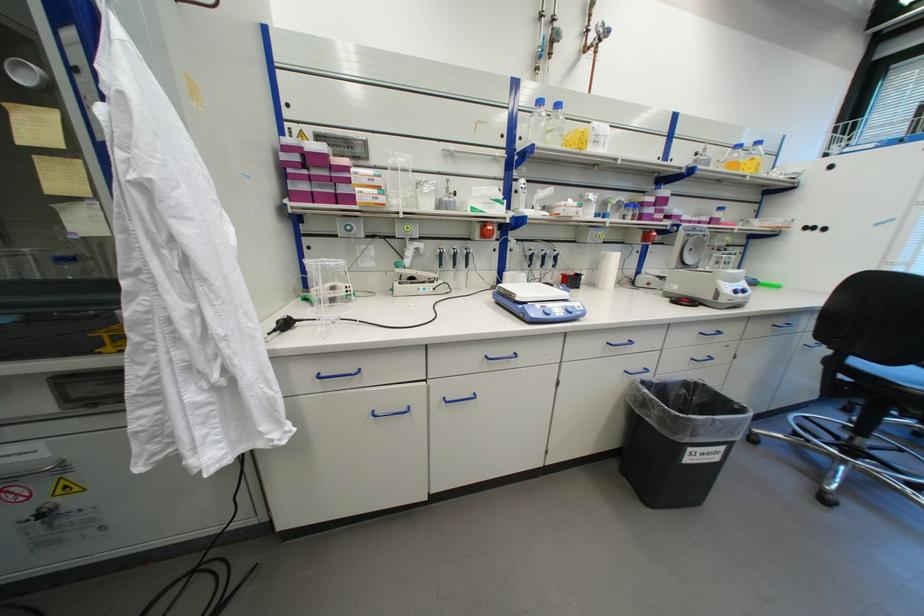
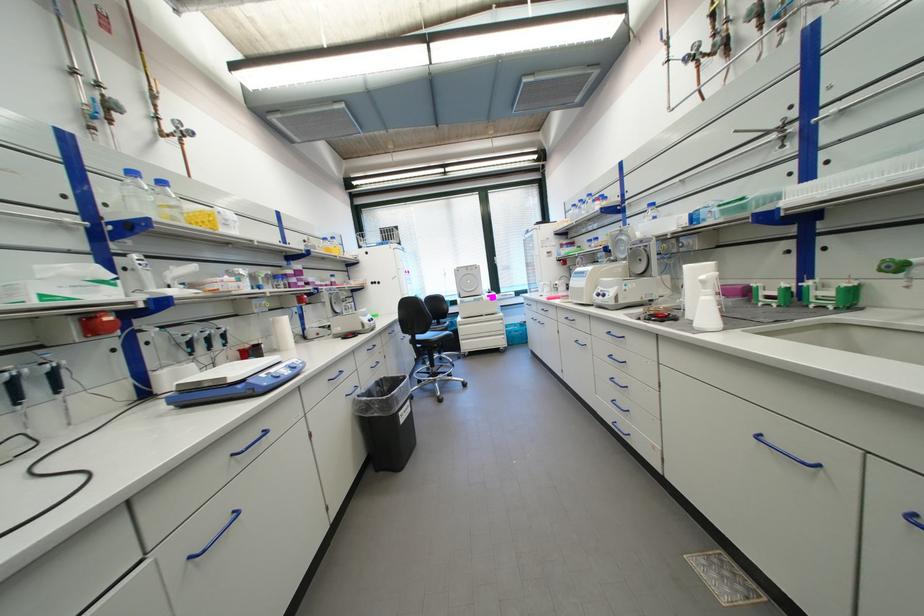
The point at (698, 450) is marked in the first image. Where is the corresponding point in the second image?

(407, 415)